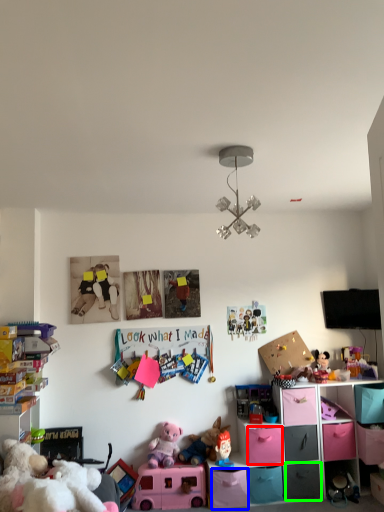
Question: Considering the real-world distances, which object is farthest from drawer (highlighted by a red box)? drawer (highlighted by a blue box) or drawer (highlighted by a green box)?

Choices:
 (A) drawer
 (B) drawer

Answer: (B)